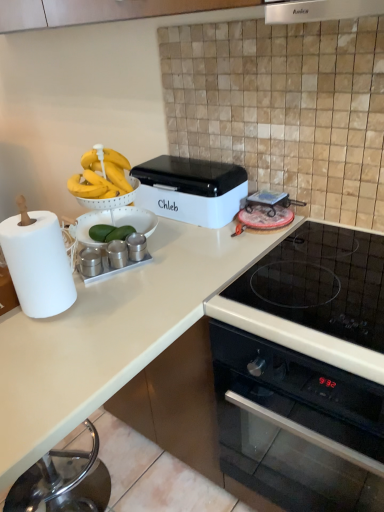
What do you see at coordinates (90, 262) in the screenshot? I see `satin silver canisters at center` at bounding box center [90, 262].

This screenshot has height=512, width=384. In order to click on white matte countertop at lower left in this screenshot , I will do `click(110, 335)`.

Locate an element on the screen. black glass oven at lower right is located at coordinates (296, 425).

Describe the element at coordinates (296, 425) in the screenshot. The width and height of the screenshot is (384, 512). I see `black glass oven at lower right` at that location.

What are the coordinates of `satin silver canisters at center` in the screenshot? It's located at (90, 262).

Does satin silver canisters at center have a lesser height compared to black glass oven at lower right?

Correct, satin silver canisters at center is not as tall as black glass oven at lower right.

From the image's perspective, relative to black glass oven at lower right, is satin silver canisters at center above or below?

From the image's perspective, satin silver canisters at center appears above black glass oven at lower right.

Looking at the image, does satin silver canisters at center seem bigger or smaller compared to black glass oven at lower right?

Considering their sizes, satin silver canisters at center takes up less space than black glass oven at lower right.

Image resolution: width=384 pixels, height=512 pixels. Find the location of `oven that appears below the satin silver canisters at center (from a real-world perspective)`. oven that appears below the satin silver canisters at center (from a real-world perspective) is located at coordinates (296, 425).

Identify the location of exhaust hood above the white paper at left (from a real-world perspective). The height and width of the screenshot is (512, 384). (319, 10).

Is white paper at left at the back of satin silver exhaust hood at upper center?

No, satin silver exhaust hood at upper center's orientation is not away from white paper at left.

Can you tell me how much white matte countertop at lower left and white plastic bread bin at center differ in facing direction?

white matte countertop at lower left and white plastic bread bin at center are facing 1.38 degrees away from each other.

Is white matte countertop at lower left far away from white plastic bread bin at center?

No, white matte countertop at lower left is in close proximity to white plastic bread bin at center.

Does white matte countertop at lower left have a greater width compared to white plastic bread bin at center?

Correct, the width of white matte countertop at lower left exceeds that of white plastic bread bin at center.

Is white matte countertop at lower left facing away from white plastic bread bin at center?

Correct, white matte countertop at lower left is looking away from white plastic bread bin at center.

Based on the photo, who is bigger, white matte countertop at lower left or satin silver canisters at center?

white matte countertop at lower left.

Which is in front, white matte countertop at lower left or satin silver canisters at center?

white matte countertop at lower left is closer to the camera.

Is white matte countertop at lower left wider or thinner than satin silver canisters at center?

Considering their sizes, white matte countertop at lower left looks broader than satin silver canisters at center.

Considering the sizes of white matte countertop at lower left and satin silver canisters at center in the image, is white matte countertop at lower left taller or shorter than satin silver canisters at center?

white matte countertop at lower left is taller than satin silver canisters at center.

Which is in front, point (279, 453) or point (98, 256)?

The point (98, 256) is more forward.

From the image's perspective, which is above, black glass oven at lower right or satin silver canisters at center?

satin silver canisters at center, from the image's perspective.

The image size is (384, 512). Identify the location of oven below the satin silver canisters at center (from the image's perspective). (296, 425).

Considering the sizes of black glass oven at lower right and satin silver canisters at center in the image, is black glass oven at lower right bigger or smaller than satin silver canisters at center?

Clearly, black glass oven at lower right is larger in size than satin silver canisters at center.

You are a GUI agent. You are given a task and a screenshot of the screen. Output one action in this format:
    pyautogui.click(x=<x>, y=<y>)
    Task: Click on the exhaust hood on the right of satin silver canisters at center
    The height and width of the screenshot is (512, 384).
    Given the screenshot: What is the action you would take?
    pyautogui.click(x=319, y=10)

Is satin silver canisters at center positioned far away from satin silver exhaust hood at upper center?

satin silver canisters at center is near satin silver exhaust hood at upper center, not far away.

From a real-world perspective, is satin silver canisters at center physically below satin silver exhaust hood at upper center?

Yes.

How many degrees apart are the facing directions of satin silver canisters at center and satin silver exhaust hood at upper center?

There is a 63.7-degree angle between the facing directions of satin silver canisters at center and satin silver exhaust hood at upper center.

Is point (367, 1) positioned after point (191, 212)?

That is False.

Considering the positions of objects satin silver exhaust hood at upper center and white plastic bread bin at center in the image provided, who is more to the right, satin silver exhaust hood at upper center or white plastic bread bin at center?

satin silver exhaust hood at upper center.

Considering the sizes of satin silver exhaust hood at upper center and white plastic bread bin at center in the image, is satin silver exhaust hood at upper center wider or thinner than white plastic bread bin at center?

Clearly, satin silver exhaust hood at upper center has more width compared to white plastic bread bin at center.

Is satin silver exhaust hood at upper center facing towards white plastic bread bin at center?

No, satin silver exhaust hood at upper center does not turn towards white plastic bread bin at center.

Image resolution: width=384 pixels, height=512 pixels. I want to click on appliance on the left of black glass oven at lower right, so click(90, 262).

This screenshot has height=512, width=384. I want to click on paper towel below the satin silver exhaust hood at upper center (from the image's perspective), so click(38, 264).

Considering their positions, is white plastic bread bin at center positioned further to white paper at left than white matte countertop at lower left?

white plastic bread bin at center lies further to white paper at left than the other object.

From the image, which object appears to be farther from satin silver exhaust hood at upper center, satin silver canisters at center or white paper at left?

Based on the image, white paper at left appears to be further to satin silver exhaust hood at upper center.

Which object lies nearer to the anchor point white plastic bread bin at center, white matte countertop at lower left or white paper at left?

white matte countertop at lower left.

Considering their positions, is satin silver canisters at center positioned further to satin silver exhaust hood at upper center than white plastic bread bin at center?

The object further to satin silver exhaust hood at upper center is satin silver canisters at center.

Looking at the image, which one is located closer to white paper at left, satin silver canisters at center or white matte countertop at lower left?

satin silver canisters at center.

Considering their positions, is satin silver canisters at center positioned further to white plastic bread bin at center than white paper at left?

The object further to white plastic bread bin at center is white paper at left.

Estimate the real-world distances between objects in this image. Which object is further from white plastic bread bin at center, white paper at left or black glass oven at lower right?

black glass oven at lower right lies further to white plastic bread bin at center than the other object.

Estimate the real-world distances between objects in this image. Which object is closer to black glass oven at lower right, satin silver canisters at center or white paper at left?

white paper at left.

Find the location of a particular element. The height and width of the screenshot is (512, 384). oven between satin silver exhaust hood at upper center and white matte countertop at lower left in the vertical direction is located at coordinates (296, 425).

You are a GUI agent. You are given a task and a screenshot of the screen. Output one action in this format:
    pyautogui.click(x=<x>, y=<y>)
    Task: Click on the appliance between white matte countertop at lower left and black glass oven at lower right
    This screenshot has width=384, height=512.
    Given the screenshot: What is the action you would take?
    pyautogui.click(x=90, y=262)

I want to click on oven between white plastic bread bin at center and white matte countertop at lower left from top to bottom, so click(296, 425).

Where is `appliance between white paper at left and white matte countertop at lower left vertically`? appliance between white paper at left and white matte countertop at lower left vertically is located at coordinates click(x=90, y=262).